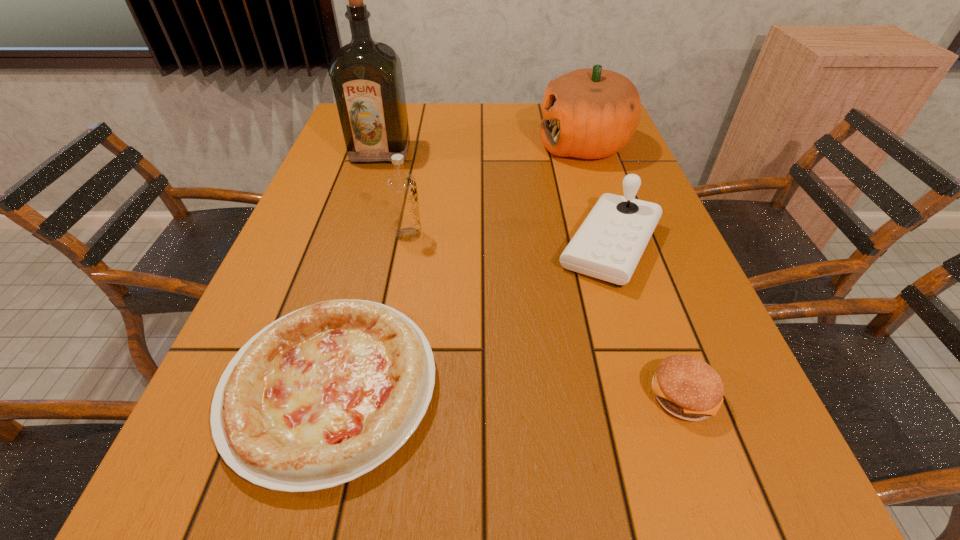
Where is `unoccupied position between the joystick and the vodka`? unoccupied position between the joystick and the vodka is located at coordinates (510, 240).

The width and height of the screenshot is (960, 540). I want to click on empty space that is in between the vodka and the joystick, so click(510, 240).

Where is `empty space between the hamburger and the tallest object`? empty space between the hamburger and the tallest object is located at coordinates (531, 274).

This screenshot has width=960, height=540. What are the coordinates of `unoccupied position between the fourth tallest object and the pumpkin` in the screenshot? It's located at (597, 196).

Image resolution: width=960 pixels, height=540 pixels. I want to click on free space between the fourth tallest object and the pizza, so click(470, 316).

This screenshot has height=540, width=960. What are the coordinates of `free space that is in between the fourth tallest object and the pizza` in the screenshot? It's located at (470, 316).

Find the location of a particular element. This screenshot has width=960, height=540. object that can be found as the fourth closest to the hamburger is located at coordinates (591, 113).

I want to click on object that is the third nearest to the joystick, so click(323, 395).

The height and width of the screenshot is (540, 960). What are the coordinates of `blank space that satisfies the following two spatial constraints: 1. on the label of the joystick; 2. on the right side of the tallest object` in the screenshot? It's located at (352, 246).

This screenshot has height=540, width=960. I want to click on free region that satisfies the following two spatial constraints: 1. on the label of the joystick; 2. on the right side of the tallest object, so click(352, 246).